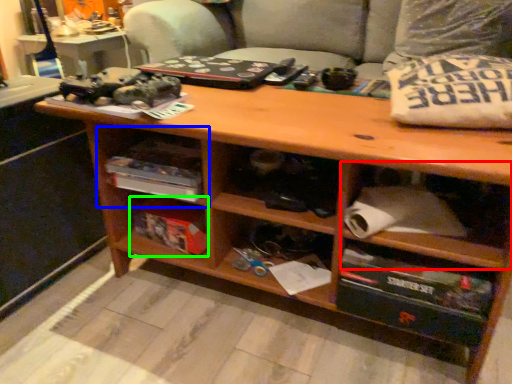
Question: Which object is the farthest from cabinet (highlighted by a red box)? Choose among these: shelf (highlighted by a blue box) or box (highlighted by a green box).

Choices:
 (A) shelf
 (B) box

Answer: (B)